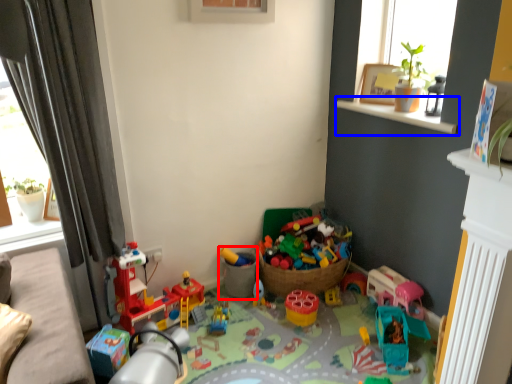
Question: Which object appears closest to the camera in this image, toy (highlighted by a red box) or window sill (highlighted by a blue box)?

Choices:
 (A) toy
 (B) window sill

Answer: (B)